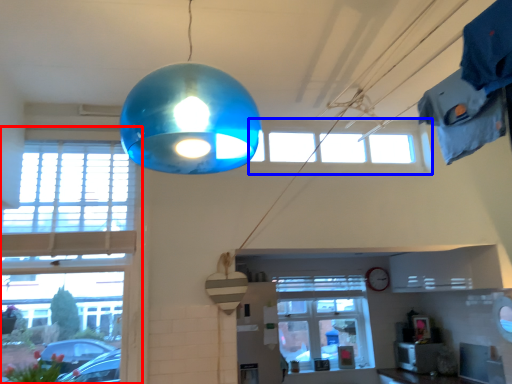
Question: Which object is further to the camera taking this photo, window (highlighted by a red box) or window (highlighted by a blue box)?

Choices:
 (A) window
 (B) window

Answer: (B)